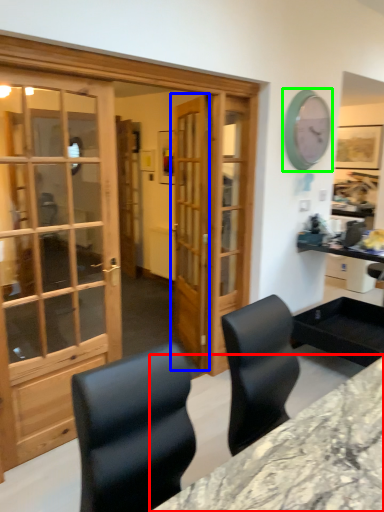
Question: Estimate the real-world distances between objects in this image. Which object is closer to desk (highlighted by a red box), door (highlighted by a blue box) or clock (highlighted by a green box)?

Choices:
 (A) door
 (B) clock

Answer: (A)